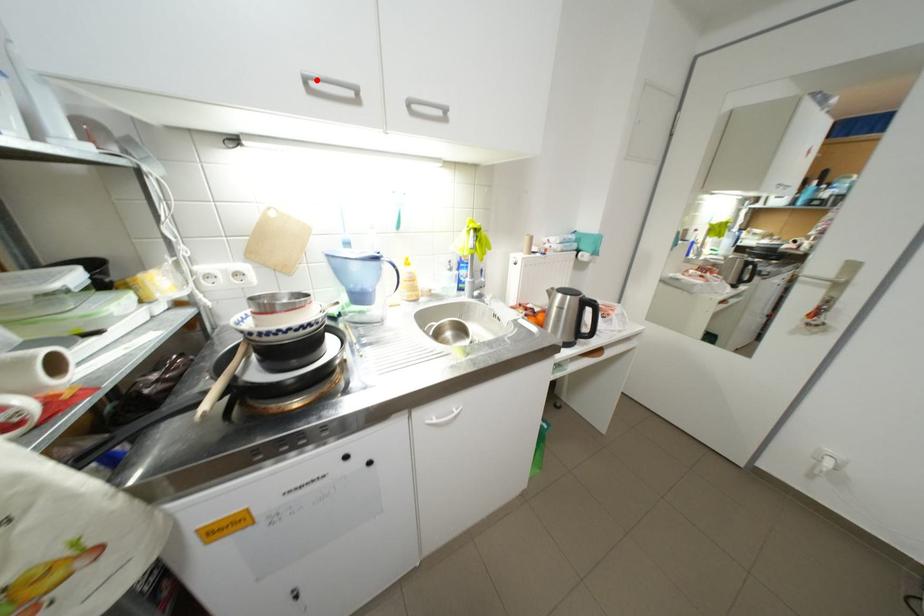
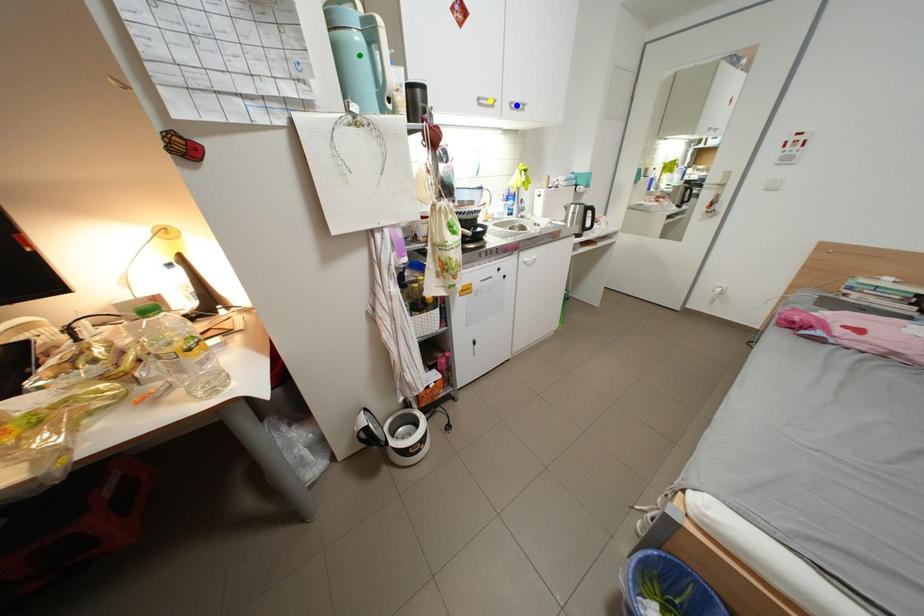
Question: I am providing you with two images of the same scene from different viewpoints. A red point is marked on the first image. You are given multiple points on the second image. Which spot in image 2 lines up with the point in image 1?

Choices:
 (A) blue point
 (B) yellow point
 (C) green point

Answer: (B)